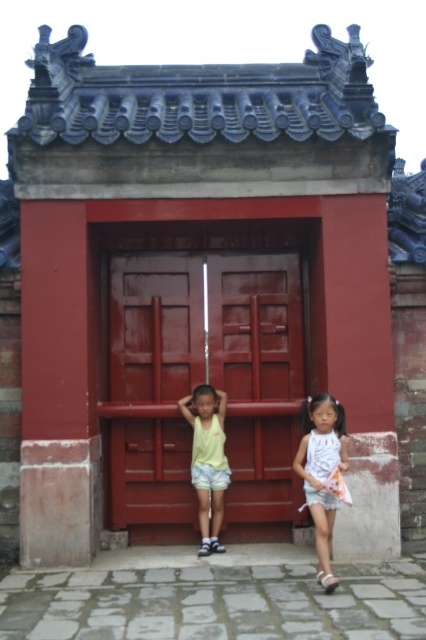
You are standing in front of the traditional Chinese temple structure. There are two points marked in the scene. The first point is at coordinates point (331, 512) and the second is at point (206, 481). From your perspective, which point is closer to you?

Point (331, 512) is closer to the camera than point (206, 481).

Consider the image. You are standing in front of the temple doors and see the white cotton dress at center. Can you estimate where it is located relative to the temple doors?

The white cotton dress at center is located at the coordinates point (322, 472) relative to the temple doors.

You are a photographer trying to capture both the matte wood door at center and the white cotton dress at center in a single frame. Given that the camera can only focus on one object at a time, which object should you focus on to ensure it takes up more of the photo?

The matte wood door at center is bigger than the white cotton dress at center, so focusing on the matte wood door at center will ensure it takes up more of the photo.